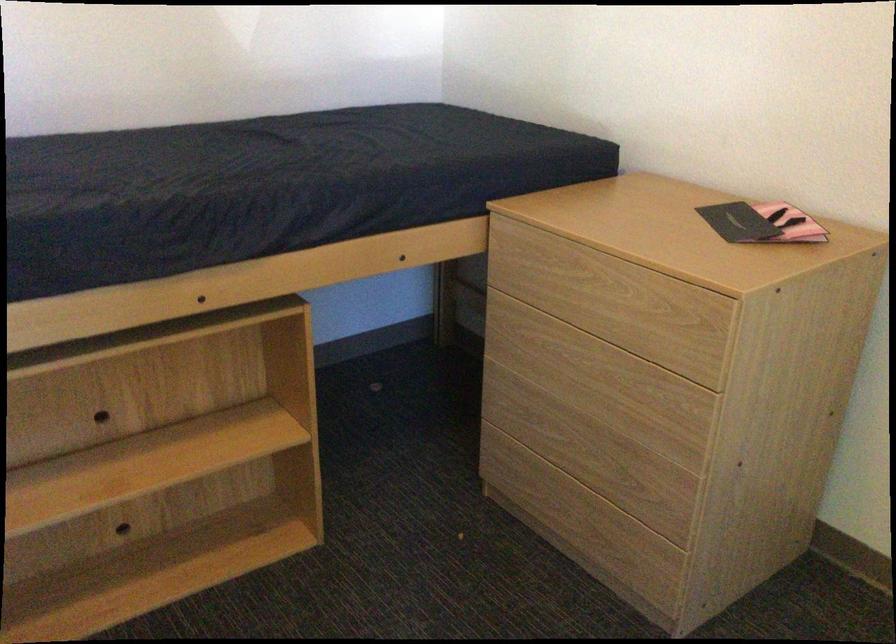
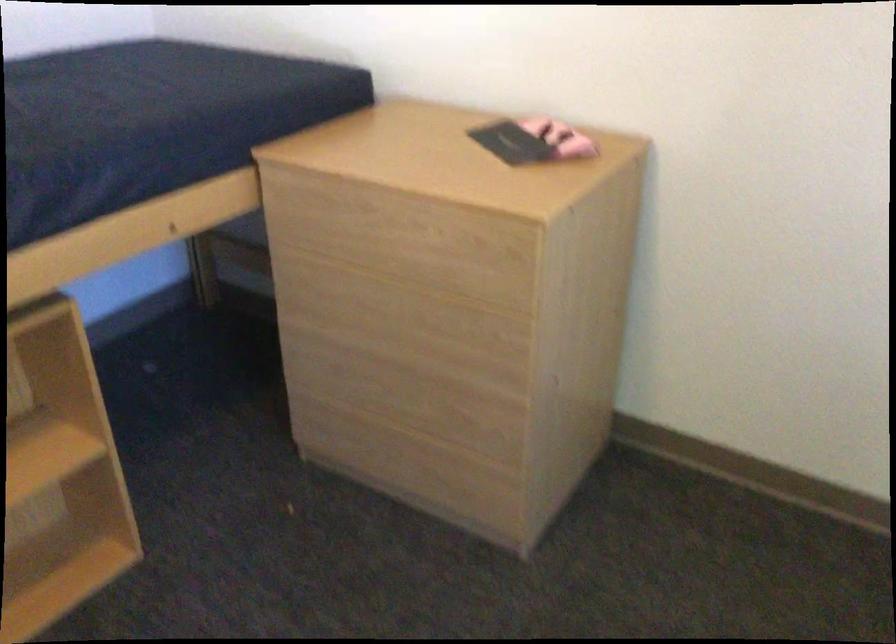
Locate, in the second image, the point that corresponds to (x=616, y=509) in the first image.

(451, 440)